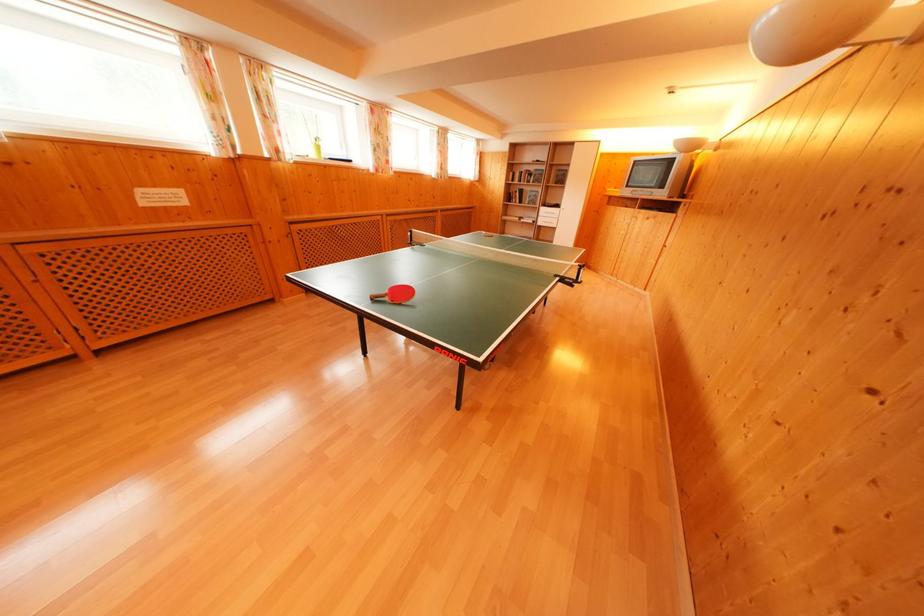
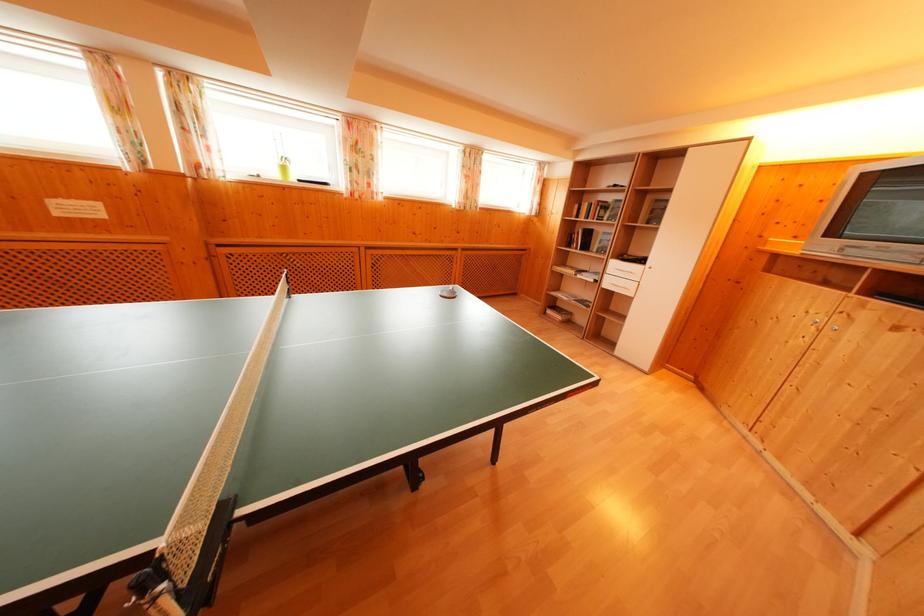
In the second image, find the point that corresponds to (545,219) in the first image.

(614, 276)